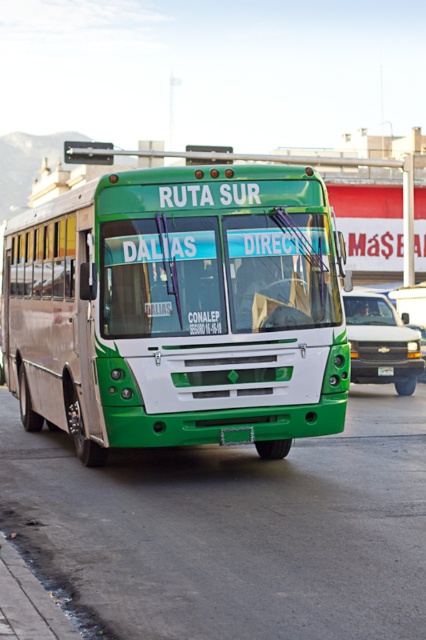
You are a pedestrian standing at the side of the road where the green matte bus at center and the matte white truck at center are parked. If you want to cross the road to the other side, which vehicle should you walk around to reach the opposite side without crossing in front of or behind either vehicle?

You should walk around the matte white truck at center because the green matte bus at center is to the left of it, so the truck is closer to your position as a pedestrian on the right side of the road. By moving around the truck, you can reach the opposite side without crossing in front or behind either vehicle.

You are a pedestrian standing at the edge of the road where the green matte bus at center and the matte white truck at center are parked. You need to cross the road to reach the park on the other side. Considering the distance between the two vehicles, can you safely walk between them to cross without needing to go around?

The green matte bus at center is 8.58 meters away from the matte white truck at center. This distance is more than sufficient for a pedestrian to safely walk between them to cross the road to the park.

You are a pedestrian standing in front of the green matte bus at center. You want to see the green matte license plate at center. Which direction should you move to get a better view of the license plate?

The green matte license plate at center is behind the green matte bus at center, so you should move to the side of the bus to get a better view of the license plate.